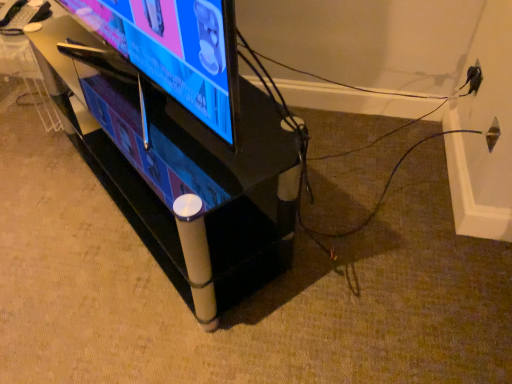
Find the location of a particular element. The image size is (512, 384). free spot in front of black glossy tv stand at center is located at coordinates [x=149, y=314].